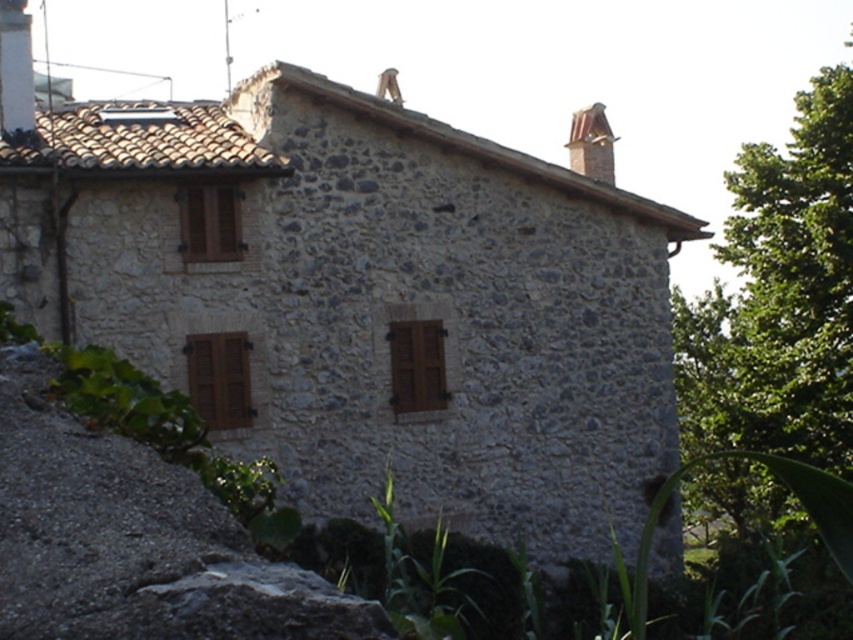
Is white stone chimney at upper left thinner than smooth terracotta chimney at upper right?

Yes.

Who is more distant from viewer, (27, 28) or (601, 144)?

The point (601, 144) is more distant.

Locate an element on the screen. The height and width of the screenshot is (640, 853). white stone chimney at upper left is located at coordinates (15, 68).

Who is more distant from viewer, (709, 488) or (572, 131)?

Point (709, 488)

Can you confirm if green leafy tree at right is thinner than smooth terracotta chimney at upper right?

Incorrect, green leafy tree at right's width is not less than smooth terracotta chimney at upper right's.

Who is more distant from viewer, (804, 97) or (598, 129)?

Point (598, 129)

At what (x,y) coordinates should I click in order to perform the action: click on green leafy tree at right. Please return your answer as a coordinate pair (x, y). Looking at the image, I should click on (779, 296).

Can you confirm if green leafy tree at right is thinner than white stone chimney at upper left?

No.

Can you confirm if green leafy tree at right is shorter than white stone chimney at upper left?

In fact, green leafy tree at right may be taller than white stone chimney at upper left.

Which is behind, point (682, 296) or point (6, 1)?

The point (682, 296) is more distant.

I want to click on green leafy tree at right, so click(779, 296).